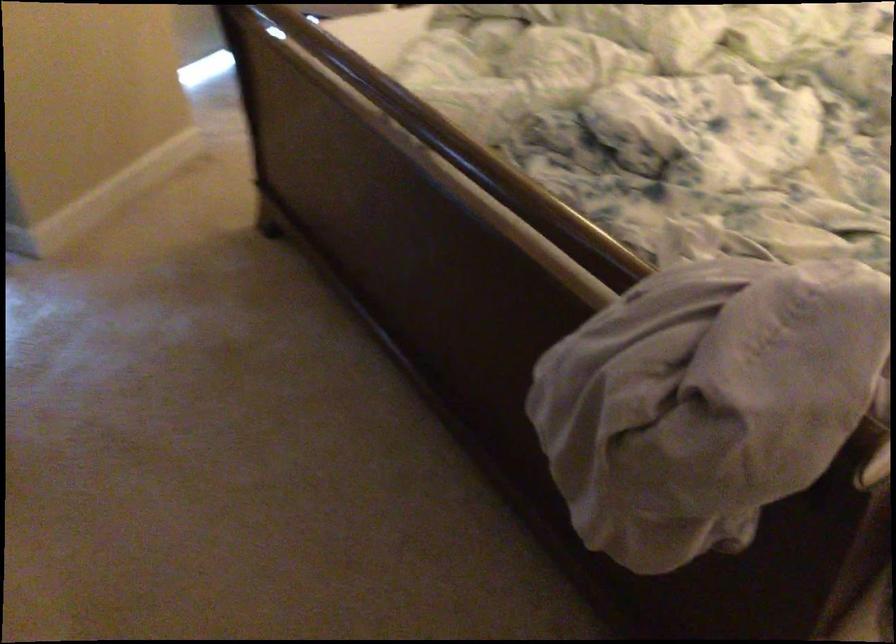
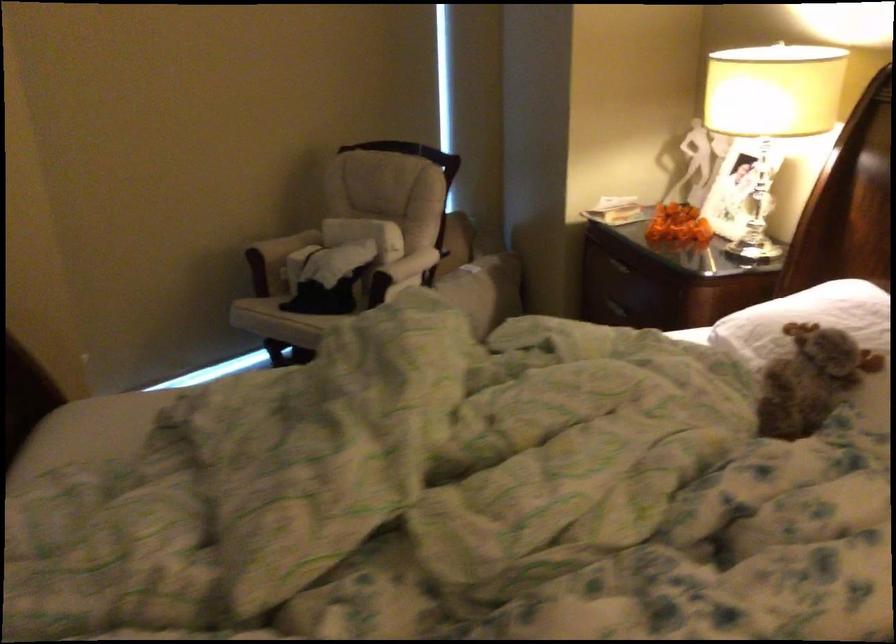
The images are taken continuously from a first-person perspective. In which direction are you moving?

The cameraman moved toward right, forward.